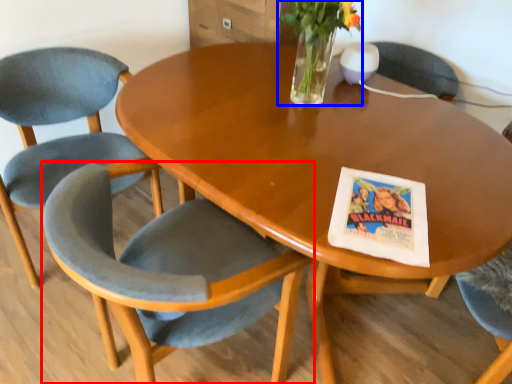
Question: Which object is closer to the camera taking this photo, chair (highlighted by a red box) or floral arrangement (highlighted by a blue box)?

Choices:
 (A) chair
 (B) floral arrangement

Answer: (A)